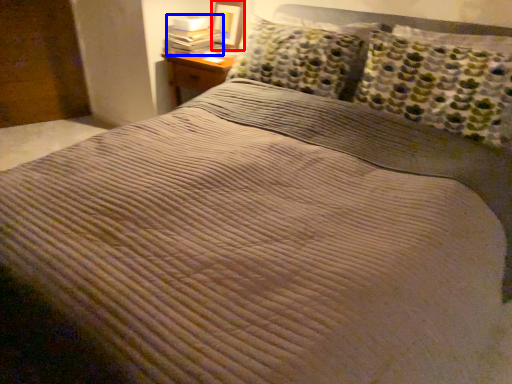
Question: Among these objects, which one is nearest to the camera, picture frame (highlighted by a red box) or book (highlighted by a blue box)?

Choices:
 (A) picture frame
 (B) book

Answer: (B)